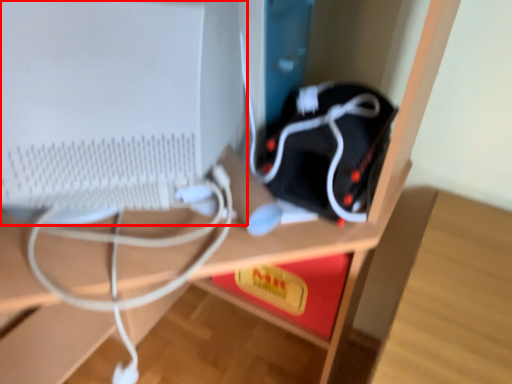
Question: From the image, what is the correct spatial relationship of computer monitor (annotated by the red box) in relation to equipment?

Choices:
 (A) left
 (B) right

Answer: (A)